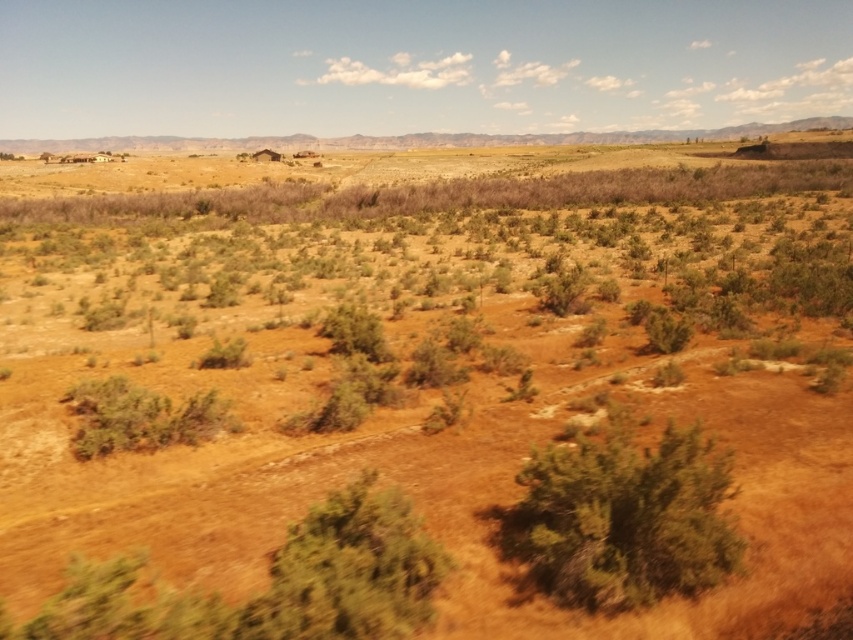
Question: Can you confirm if green leafy bush at center is positioned below green leafy bush at lower center?

Choices:
 (A) no
 (B) yes

Answer: (A)

Question: Is green leafy bush at center bigger than green leafy bush at lower center?

Choices:
 (A) yes
 (B) no

Answer: (A)

Question: Which point is farther from the camera taking this photo?

Choices:
 (A) (654, 580)
 (B) (410, 588)

Answer: (A)

Question: Is green leafy bush at center to the right of green leafy bush at lower center from the viewer's perspective?

Choices:
 (A) yes
 (B) no

Answer: (A)

Question: Which point is closer to the camera?

Choices:
 (A) (410, 596)
 (B) (627, 502)

Answer: (A)

Question: Which of the following is the farthest from the observer?

Choices:
 (A) (277, 595)
 (B) (614, 602)

Answer: (B)